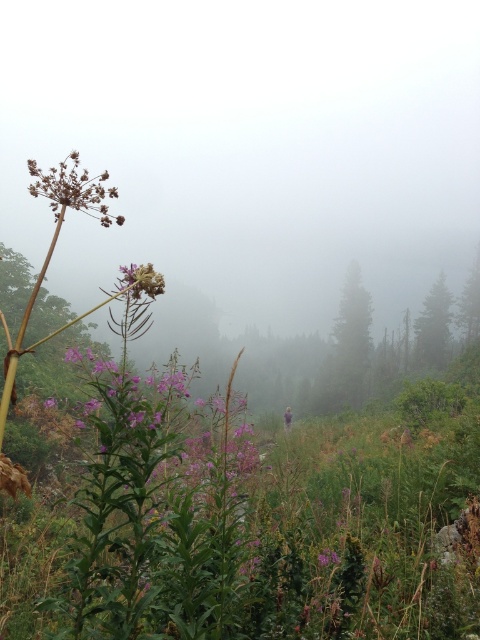
Does brown textured flower at upper left have a lesser height compared to purple matte flower at upper left?

No, brown textured flower at upper left is not shorter than purple matte flower at upper left.

Can you confirm if brown textured flower at upper left is taller than purple matte flower at upper left?

Yes, brown textured flower at upper left is taller than purple matte flower at upper left.

Image resolution: width=480 pixels, height=640 pixels. Describe the element at coordinates (73, 189) in the screenshot. I see `brown textured flower at upper left` at that location.

Find the location of a particular element. The image size is (480, 640). brown textured flower at upper left is located at coordinates (73, 189).

Image resolution: width=480 pixels, height=640 pixels. Find the location of `green matte tree at right`. green matte tree at right is located at coordinates (432, 326).

Is green matte tree at right smaller than purple matte flower at upper left?

Yes, green matte tree at right is smaller than purple matte flower at upper left.

Identify the location of green matte tree at right. (432, 326).

Which is more to the left, green matte tree at center or green matte tree at right?

green matte tree at center

In the scene shown: Can you confirm if green matte tree at center is wider than green matte tree at right?

Yes.

Is point (369, 314) in front of point (423, 308)?

That is True.

You are a GUI agent. You are given a task and a screenshot of the screen. Output one action in this format:
    pyautogui.click(x=<x>, y=<y>)
    Task: Click on the green matte tree at center
    The width and height of the screenshot is (480, 640).
    Given the screenshot: What is the action you would take?
    pyautogui.click(x=347, y=352)